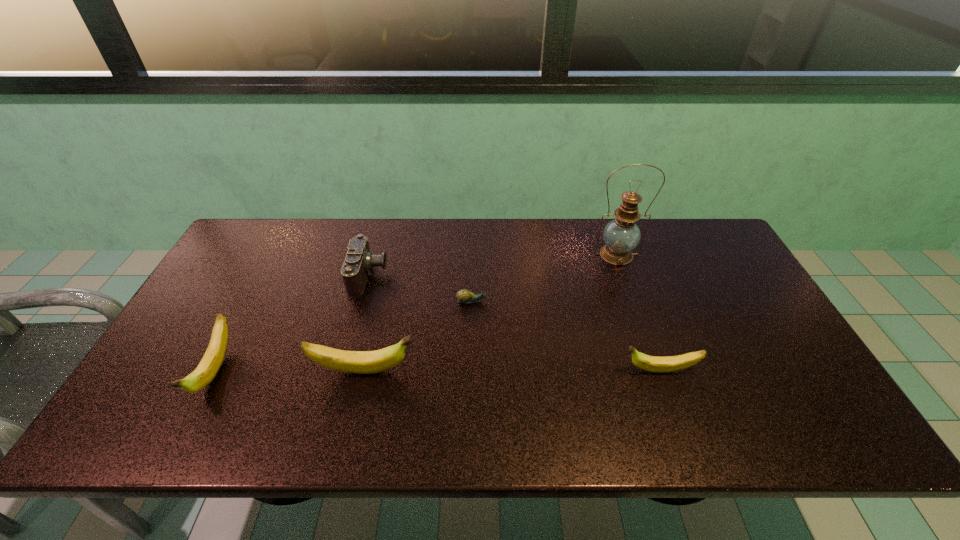
Please determine a free point for an extra banana to ensure balance. Please provide its 2D coordinates. Your answer should be formatted as a tuple, i.e. [(x, y)], where the tuple contains the x and y coordinates of a point satisfying the conditions above.

[(512, 370)]